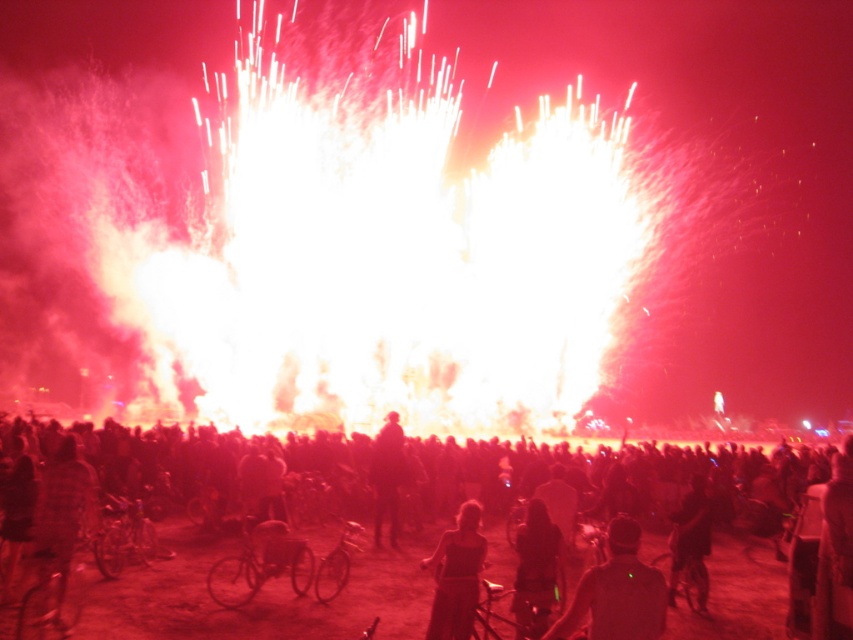
Question: Based on their relative distances, which object is farther from the matte black dress at center?

Choices:
 (A) silhouette figure at center
 (B) dark hair at center

Answer: (A)

Question: Which point is closer to the camera?

Choices:
 (A) (682, 538)
 (B) (183, 490)
 (C) (469, 547)

Answer: (C)

Question: Can you confirm if matte black dress at center is thinner than dark matte bicycle at center?

Choices:
 (A) no
 (B) yes

Answer: (B)

Question: Which object is positioned closest to the silhouette fabric person at center?

Choices:
 (A) matte black dress at center
 (B) silhouette figure at center
 (C) silhouette of person at center

Answer: (A)

Question: Is dark hair at center bigger than matte black dress at center?

Choices:
 (A) yes
 (B) no

Answer: (A)

Question: Is dark matte bicycle at center below silhouette figure at center?

Choices:
 (A) yes
 (B) no

Answer: (A)